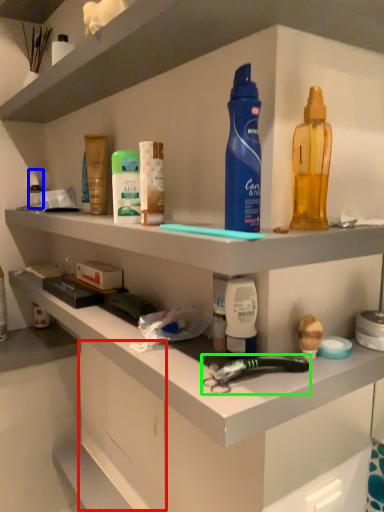
Question: Considering the real-world distances, which object is closest to drawer (highlighted by a red box)? toiletry (highlighted by a blue box) or tool (highlighted by a green box).

Choices:
 (A) toiletry
 (B) tool

Answer: (B)